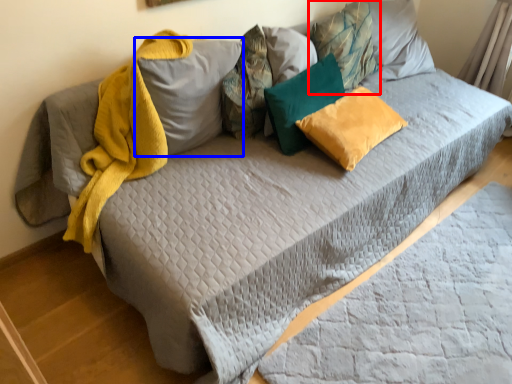
Question: Among these objects, which one is nearest to the camera, pillow (highlighted by a red box) or pillow (highlighted by a blue box)?

Choices:
 (A) pillow
 (B) pillow

Answer: (B)